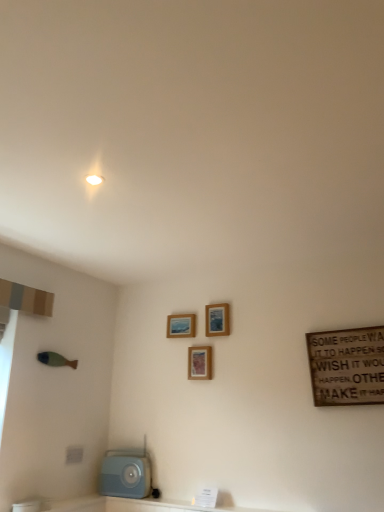
What do you see at coordinates (125, 474) in the screenshot? This screenshot has height=512, width=384. I see `light blue plastic radio at lower left` at bounding box center [125, 474].

Image resolution: width=384 pixels, height=512 pixels. In order to click on wooden picture frame at upper center, the 3th picture frame positioned from the left in this screenshot , I will do `click(217, 319)`.

This screenshot has width=384, height=512. In order to click on wooden picture frame at center, the second picture frame viewed from the right in this screenshot , I will do `click(200, 362)`.

From the image's perspective, is wooden picture frame at upper center, which ranks as the 1th picture frame in right-to-left order, on wooden signboard at right?

Yes, from the image's perspective, wooden picture frame at upper center, which ranks as the 1th picture frame in right-to-left order, is over wooden signboard at right.

From a real-world perspective, is wooden picture frame at upper center, which ranks as the 1th picture frame in right-to-left order, below wooden signboard at right?

No, from a real-world perspective, wooden picture frame at upper center, which ranks as the 1th picture frame in right-to-left order, is not beneath wooden signboard at right.

Considering the relative sizes of wooden picture frame at upper center, the 3th picture frame positioned from the left, and wooden signboard at right in the image provided, is wooden picture frame at upper center, the 3th picture frame positioned from the left, shorter than wooden signboard at right?

Yes, wooden picture frame at upper center, the 3th picture frame positioned from the left, is shorter than wooden signboard at right.

Can you tell me how much wooden picture frame at upper center, the 3th picture frame positioned from the left, and wooden signboard at right differ in facing direction?

The angular difference between wooden picture frame at upper center, the 3th picture frame positioned from the left, and wooden signboard at right is 0.0486 degrees.

From the image's perspective, is light blue plastic radio at lower left located above wooden picture frame at upper center, the 3th picture frame positioned from the left?

No, from the image's perspective, light blue plastic radio at lower left is not on top of wooden picture frame at upper center, the 3th picture frame positioned from the left.

Is light blue plastic radio at lower left next to wooden picture frame at upper center, the 3th picture frame positioned from the left, and touching it?

No.

What are the coordinates of `appliance below the wooden picture frame at upper center, the 3th picture frame positioned from the left (from a real-world perspective)` in the screenshot? It's located at (125, 474).

In terms of height, does light blue plastic radio at lower left look taller or shorter compared to wooden picture frame at upper center, which ranks as the 1th picture frame in right-to-left order?

Clearly, light blue plastic radio at lower left is taller compared to wooden picture frame at upper center, which ranks as the 1th picture frame in right-to-left order.

Is light blue plastic radio at lower left at the back of wooden picture frame at center, the second picture frame viewed from the right?

No, wooden picture frame at center, the second picture frame viewed from the right, is not facing the opposite direction of light blue plastic radio at lower left.

From a real-world perspective, does wooden picture frame at center, the second picture frame viewed from the right, stand above light blue plastic radio at lower left?

Yes, from a real-world perspective, wooden picture frame at center, the second picture frame viewed from the right, is on top of light blue plastic radio at lower left.

Measure the distance from wooden picture frame at center, the second picture frame viewed from the right, to light blue plastic radio at lower left.

A distance of 28.78 inches exists between wooden picture frame at center, the second picture frame viewed from the right, and light blue plastic radio at lower left.

Choose the correct answer: Is wooden picture frame at center, the second picture frame viewed from the right, inside light blue plastic radio at lower left or outside it?

wooden picture frame at center, the second picture frame viewed from the right, exists outside the volume of light blue plastic radio at lower left.

How many degrees apart are the facing directions of wooden picture frame at upper center, the third picture frame from the right, and wooden picture frame at upper center, which ranks as the 1th picture frame in right-to-left order?

They differ by 0.74 degrees in their facing directions.

Between point (182, 323) and point (214, 305), which one is positioned behind?

The point (182, 323) is farther.

Who is shorter, wooden picture frame at upper center, the first picture frame viewed from the left, or wooden picture frame at upper center, the 3th picture frame positioned from the left?

With less height is wooden picture frame at upper center, the first picture frame viewed from the left.

From a real-world perspective, is wooden picture frame at upper center, the 3th picture frame positioned from the left, over wooden picture frame at center, the second picture frame viewed from the right?

Indeed, from a real-world perspective, wooden picture frame at upper center, the 3th picture frame positioned from the left, stands above wooden picture frame at center, the second picture frame viewed from the right.

Which is more to the left, wooden picture frame at upper center, the 3th picture frame positioned from the left, or wooden picture frame at center, the second picture frame viewed from the right?

From the viewer's perspective, wooden picture frame at center, the second picture frame viewed from the right, appears more on the left side.

From the picture: Is wooden picture frame at upper center, the 3th picture frame positioned from the left, facing towards wooden picture frame at center, the second picture frame viewed from the right?

No, wooden picture frame at upper center, the 3th picture frame positioned from the left, is not turned towards wooden picture frame at center, the second picture frame viewed from the right.

Is wooden picture frame at center, the second picture frame viewed from the right, surrounded by wooden picture frame at upper center, which ranks as the 1th picture frame in right-to-left order?

No, wooden picture frame at upper center, which ranks as the 1th picture frame in right-to-left order, does not contain wooden picture frame at center, the second picture frame viewed from the right.

Can you confirm if wooden picture frame at upper center, the 3th picture frame positioned from the left, is bigger than light blue plastic radio at lower left?

Actually, wooden picture frame at upper center, the 3th picture frame positioned from the left, might be smaller than light blue plastic radio at lower left.

Consider the image. Is wooden picture frame at upper center, the 3th picture frame positioned from the left, facing towards light blue plastic radio at lower left?

No, wooden picture frame at upper center, the 3th picture frame positioned from the left, is not turned towards light blue plastic radio at lower left.

At what (x,y) coordinates should I click in order to perform the action: click on appliance below the wooden picture frame at upper center, the 3th picture frame positioned from the left (from a real-world perspective). Please return your answer as a coordinate pair (x, y). Looking at the image, I should click on (125, 474).

From the image's perspective, is wooden picture frame at upper center, the 3th picture frame positioned from the left, positioned above or below light blue plastic radio at lower left?

wooden picture frame at upper center, the 3th picture frame positioned from the left, is above light blue plastic radio at lower left.

Is point (168, 318) positioned in front of point (105, 458)?

No, (168, 318) is behind (105, 458).

Locate an element on the screen. The image size is (384, 512). appliance located underneath the wooden picture frame at upper center, the third picture frame from the right (from a real-world perspective) is located at coordinates (125, 474).

Are wooden picture frame at upper center, the first picture frame viewed from the left, and light blue plastic radio at lower left beside each other?

wooden picture frame at upper center, the first picture frame viewed from the left, and light blue plastic radio at lower left are clearly separated.

Starting from the wooden signboard at right, which picture frame is the 2nd one behind? Please provide its 2D coordinates.

[(217, 319)]

This screenshot has height=512, width=384. Find the location of `appliance that is on the left side of wooden picture frame at upper center, which ranks as the 1th picture frame in right-to-left order`. appliance that is on the left side of wooden picture frame at upper center, which ranks as the 1th picture frame in right-to-left order is located at coordinates (125, 474).

From the image, which object appears to be farther from wooden picture frame at center, placed as the second picture frame when sorted from left to right, wooden picture frame at upper center, the third picture frame from the right, or light blue plastic radio at lower left?

The object further to wooden picture frame at center, placed as the second picture frame when sorted from left to right, is light blue plastic radio at lower left.

Considering their positions, is wooden signboard at right positioned closer to wooden picture frame at center, placed as the second picture frame when sorted from left to right, than wooden picture frame at upper center, the third picture frame from the right?

Among the two, wooden picture frame at upper center, the third picture frame from the right, is located nearer to wooden picture frame at center, placed as the second picture frame when sorted from left to right.

Looking at the image, which one is located closer to light blue plastic radio at lower left, wooden picture frame at upper center, the 3th picture frame positioned from the left, or wooden picture frame at center, placed as the second picture frame when sorted from left to right?

wooden picture frame at center, placed as the second picture frame when sorted from left to right, lies closer to light blue plastic radio at lower left than the other object.

When comparing their distances from wooden signboard at right, does wooden picture frame at upper center, the third picture frame from the right, or light blue plastic radio at lower left seem closer?

wooden picture frame at upper center, the third picture frame from the right, lies closer to wooden signboard at right than the other object.

Estimate the real-world distances between objects in this image. Which object is closer to wooden picture frame at upper center, the first picture frame viewed from the left, wooden picture frame at upper center, which ranks as the 1th picture frame in right-to-left order, or wooden picture frame at center, placed as the second picture frame when sorted from left to right?

Based on the image, wooden picture frame at upper center, which ranks as the 1th picture frame in right-to-left order, appears to be nearer to wooden picture frame at upper center, the first picture frame viewed from the left.

Based on their spatial positions, is wooden picture frame at upper center, which ranks as the 1th picture frame in right-to-left order, or wooden picture frame at center, placed as the second picture frame when sorted from left to right, closer to wooden signboard at right?

wooden picture frame at upper center, which ranks as the 1th picture frame in right-to-left order, lies closer to wooden signboard at right than the other object.

Estimate the real-world distances between objects in this image. Which object is further from wooden picture frame at upper center, which ranks as the 1th picture frame in right-to-left order, wooden signboard at right or wooden picture frame at upper center, the first picture frame viewed from the left?

Based on the image, wooden signboard at right appears to be further to wooden picture frame at upper center, which ranks as the 1th picture frame in right-to-left order.

Looking at the image, which one is located closer to wooden picture frame at upper center, which ranks as the 1th picture frame in right-to-left order, wooden picture frame at center, placed as the second picture frame when sorted from left to right, or wooden signboard at right?

The object closer to wooden picture frame at upper center, which ranks as the 1th picture frame in right-to-left order, is wooden picture frame at center, placed as the second picture frame when sorted from left to right.

Where is `picture frame between wooden picture frame at upper center, the first picture frame viewed from the left, and light blue plastic radio at lower left vertically`? The image size is (384, 512). picture frame between wooden picture frame at upper center, the first picture frame viewed from the left, and light blue plastic radio at lower left vertically is located at coordinates (200, 362).

Find the location of `picture frame between wooden picture frame at upper center, the 3th picture frame positioned from the left, and wooden picture frame at center, the second picture frame viewed from the right, in the up-down direction`. picture frame between wooden picture frame at upper center, the 3th picture frame positioned from the left, and wooden picture frame at center, the second picture frame viewed from the right, in the up-down direction is located at coordinates (181, 325).

Locate an element on the screen. The image size is (384, 512). picture frame situated between wooden picture frame at center, placed as the second picture frame when sorted from left to right, and wooden signboard at right from left to right is located at coordinates (217, 319).